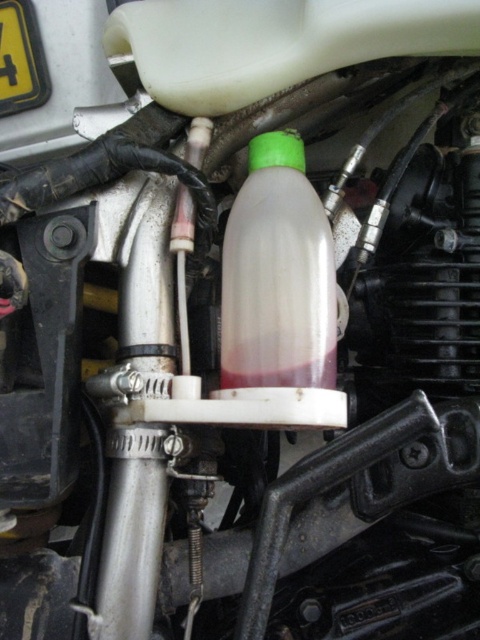
Does translucent plastic bottle at center appear on the right side of yellow plastic license plate at upper left?

Correct, you'll find translucent plastic bottle at center to the right of yellow plastic license plate at upper left.

Which is in front, point (291, 312) or point (25, 49)?

Point (291, 312)

Identify the location of translucent plastic bottle at center. (277, 275).